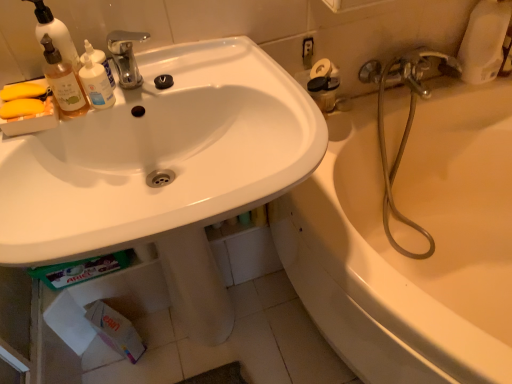
You are a GUI agent. You are given a task and a screenshot of the screen. Output one action in this format:
    pyautogui.click(x=<x>, y=<y>)
    Task: Click on the vacant space to the right of translucent plastic bottle at upper left
    
    Given the screenshot: What is the action you would take?
    pyautogui.click(x=190, y=70)